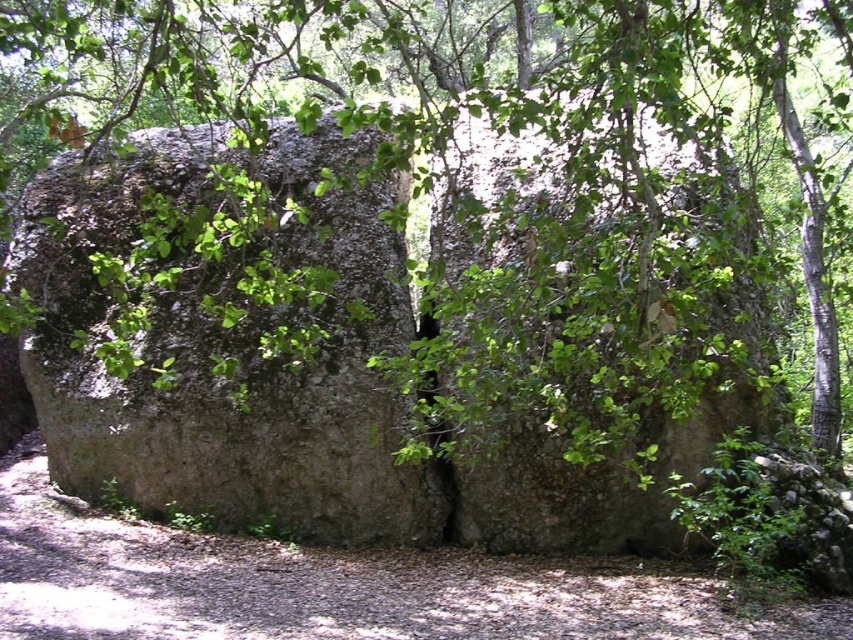
You are standing in a forest and see the green leafy tree at center. If you want to reach it, how many steps would you need to take? Assume each step covers about 3 feet.

The green leafy tree at center is 39.45 feet away from viewer. Since each step covers about 3 feet, you would need to take approximately 13 steps to reach it.

You are a hiker navigating through the forest and want to reach a specific point. You see two points marked in the image. Which point is closer to you, point (x=469, y=88) or point (x=45, y=529)?

Point (x=45, y=529) is closer to you because it is in front of point (x=469, y=88).